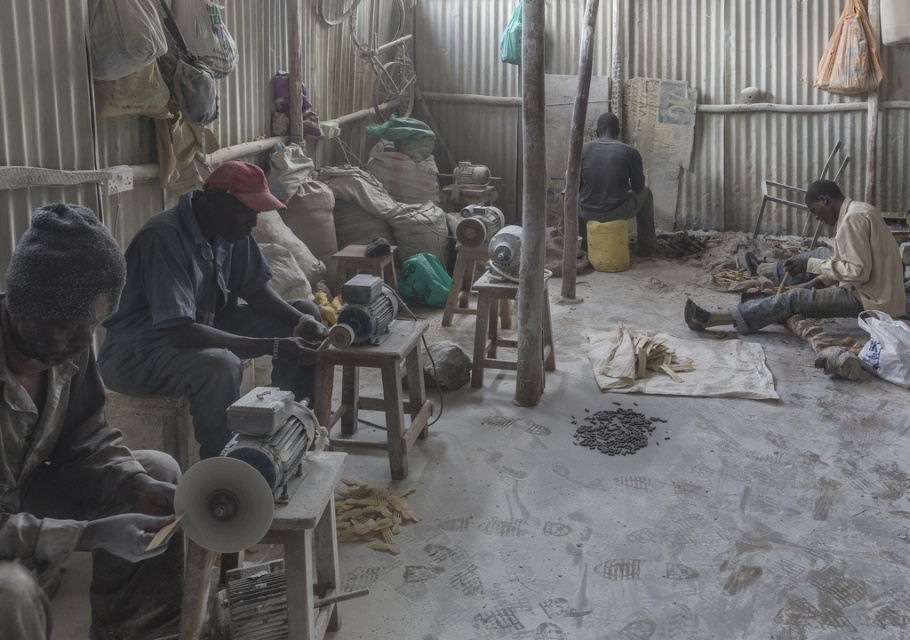
You are a visitor in this workshop and want to place a small plant pot between the light beige fabric at lower right and the wooden stool at center. Can you fit it vertically between them?

The light beige fabric at lower right is taller than the wooden stool at center, so there might not be enough vertical space to fit the plant pot between them unless the pot is shorter than the difference in their heights.

You are organizing a workshop cleanup and need to place a new tool box between the dark gray fabric at left and the wooden stool at center. Based on their positions, which object should the tool box be placed closer to?

The tool box should be placed closer to the wooden stool at center because the dark gray fabric at left is positioned on the left side of the wooden stool at center, meaning the stool is to the right of the fabric. Therefore, placing the tool box closer to the stool would maintain the spatial arrangement.

You are standing in the workshop and want to sit down on the wooden stool at center. However, there is a dark gray fabric at center in the way. Can you reach the stool without moving the fabric?

The wooden stool at center is closer to the viewer than the dark gray fabric at center, so you can reach the stool without needing to move the fabric because it is already in front of the fabric.